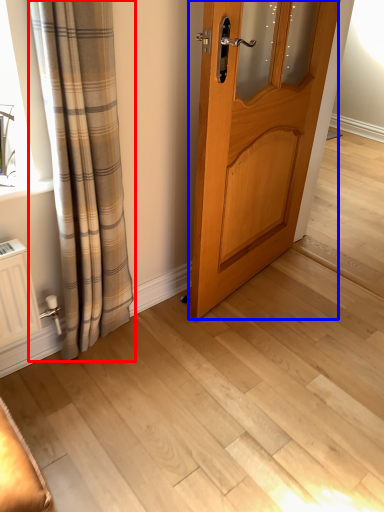
Question: Which object is closer to the camera taking this photo, curtain (highlighted by a red box) or door (highlighted by a blue box)?

Choices:
 (A) curtain
 (B) door

Answer: (A)